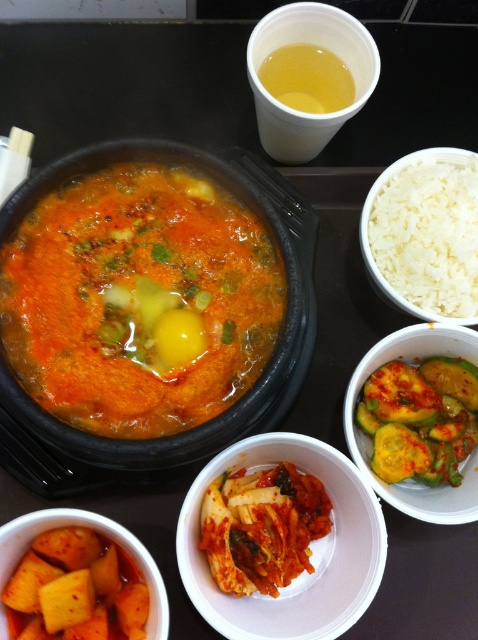
You are a GUI agent. You are given a task and a screenshot of the screen. Output one action in this format:
    pyautogui.click(x=<x>, y=<y>)
    Task: Click on the pickled vegetables at center
    This screenshot has height=640, width=478.
    Given the screenshot: What is the action you would take?
    pyautogui.click(x=310, y=545)

Which is above, pickled vegetables at center or white polished rice at upper right?

Positioned higher is white polished rice at upper right.

Locate an element on the screen. This screenshot has height=640, width=478. pickled vegetables at center is located at coordinates (310, 545).

Where is `pickled vegetables at center`? pickled vegetables at center is located at coordinates (310, 545).

Is tomato-colored broth at center below translucent yellow liquid at upper center?

Yes, tomato-colored broth at center is below translucent yellow liquid at upper center.

What do you see at coordinates (139, 300) in the screenshot? The height and width of the screenshot is (640, 478). I see `tomato-colored broth at center` at bounding box center [139, 300].

I want to click on tomato-colored broth at center, so click(139, 300).

Is point (440, 481) closer to camera compared to point (340, 65)?

Yes, it is in front of point (340, 65).

Who is more forward, (x=449, y=401) or (x=278, y=52)?

Point (x=449, y=401) is in front.

Between point (409, 371) and point (332, 81), which one is positioned behind?

The point (332, 81) is more distant.

This screenshot has height=640, width=478. I want to click on green pickled cucumber at lower right, so click(421, 419).